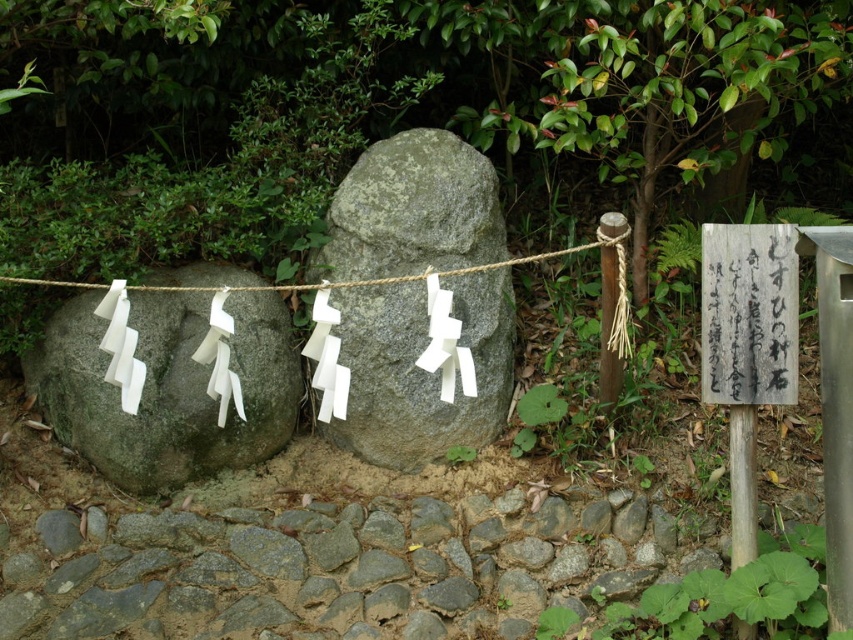
Which is more to the right, gray rough stone at center or braided rope at center?

Positioned to the right is gray rough stone at center.

Locate an element on the screen. Image resolution: width=853 pixels, height=640 pixels. gray rough stone at center is located at coordinates (421, 369).

Describe the element at coordinates (421, 369) in the screenshot. The width and height of the screenshot is (853, 640). I see `gray rough stone at center` at that location.

The width and height of the screenshot is (853, 640). In order to click on gray rough stone at center in this screenshot , I will do `click(421, 369)`.

Does gray rough stone at left have a greater height compared to wooden signpost at center right?

Correct, gray rough stone at left is much taller as wooden signpost at center right.

Between gray rough stone at left and wooden signpost at center right, which one is positioned lower?

gray rough stone at left is below.

At what (x,y) coordinates should I click in order to perform the action: click on gray rough stone at left. Please return your answer as a coordinate pair (x, y). The width and height of the screenshot is (853, 640). Looking at the image, I should click on (167, 387).